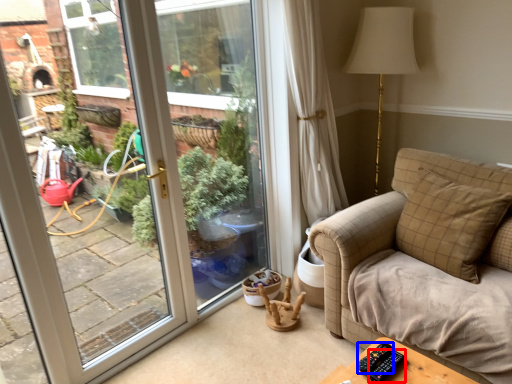
Question: Which object appears farthest to the camera in this image, remote (highlighted by a red box) or remote (highlighted by a blue box)?

Choices:
 (A) remote
 (B) remote

Answer: (B)